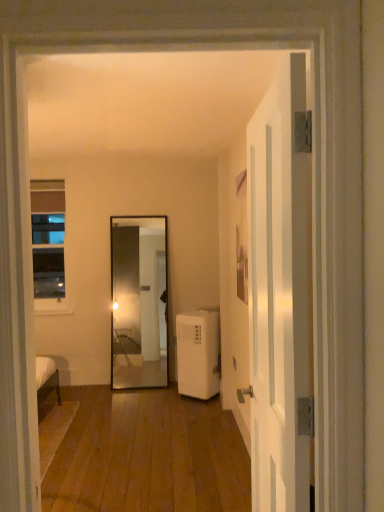
Question: Is white glossy door at right to the right of white plastic air conditioner at lower right from the viewer's perspective?

Choices:
 (A) no
 (B) yes

Answer: (B)

Question: Can you confirm if white glossy door at right is positioned to the left of white plastic air conditioner at lower right?

Choices:
 (A) no
 (B) yes

Answer: (A)

Question: Is white glossy door at right positioned with its back to white plastic air conditioner at lower right?

Choices:
 (A) yes
 (B) no

Answer: (B)

Question: Does white glossy door at right have a greater height compared to white plastic air conditioner at lower right?

Choices:
 (A) yes
 (B) no

Answer: (A)

Question: From the image's perspective, is white glossy door at right located beneath white plastic air conditioner at lower right?

Choices:
 (A) no
 (B) yes

Answer: (A)

Question: Is white glossy door at right positioned before white plastic air conditioner at lower right?

Choices:
 (A) yes
 (B) no

Answer: (A)

Question: From the image's perspective, is white plastic air conditioner at lower right located beneath clear glass window at left?

Choices:
 (A) no
 (B) yes

Answer: (B)

Question: Is white plastic air conditioner at lower right surrounding clear glass window at left?

Choices:
 (A) yes
 (B) no

Answer: (B)

Question: Is white plastic air conditioner at lower right located outside clear glass window at left?

Choices:
 (A) yes
 (B) no

Answer: (A)

Question: Can you confirm if white plastic air conditioner at lower right is shorter than clear glass window at left?

Choices:
 (A) no
 (B) yes

Answer: (B)

Question: Considering the relative sizes of white plastic air conditioner at lower right and clear glass window at left in the image provided, is white plastic air conditioner at lower right taller than clear glass window at left?

Choices:
 (A) yes
 (B) no

Answer: (B)

Question: Is white plastic air conditioner at lower right oriented away from clear glass window at left?

Choices:
 (A) yes
 (B) no

Answer: (B)

Question: Is white glossy door at right thinner than clear glass window at left?

Choices:
 (A) no
 (B) yes

Answer: (A)